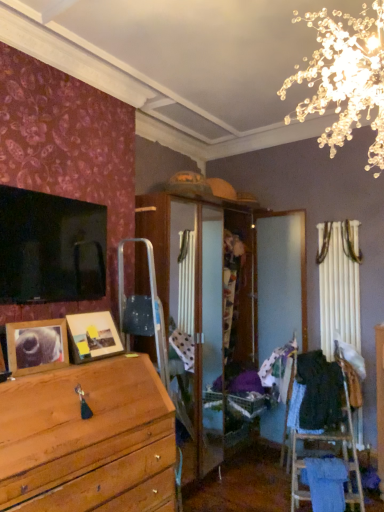
Question: Is black fabric at right, the first clothing when ordered from right to left, wider or thinner than patterned fabric at center, which is the 2th clothing in right-to-left order?

Choices:
 (A) wide
 (B) thin

Answer: (A)

Question: Is black fabric at right, which appears as the second clothing when viewed from the left, inside the boundaries of patterned fabric at center, positioned as the first clothing in left-to-right order, or outside?

Choices:
 (A) outside
 (B) inside

Answer: (A)

Question: Which object is the closest to the black fabric at right, the first clothing when ordered from right to left?

Choices:
 (A) patterned fabric at center, which is the 2th clothing in right-to-left order
 (B) wooden picture frame at lower left, arranged as the second picture frame when viewed from the back
 (C) wooden photo frame at center, which is the first picture frame in back-to-front order

Answer: (A)

Question: Which object is positioned closest to the black fabric at right, the first clothing when ordered from right to left?

Choices:
 (A) wooden photo frame at center, acting as the 2th picture frame starting from the front
 (B) patterned fabric at center, which is the 2th clothing in right-to-left order
 (C) wooden picture frame at lower left, the 1th picture frame viewed from the front

Answer: (B)